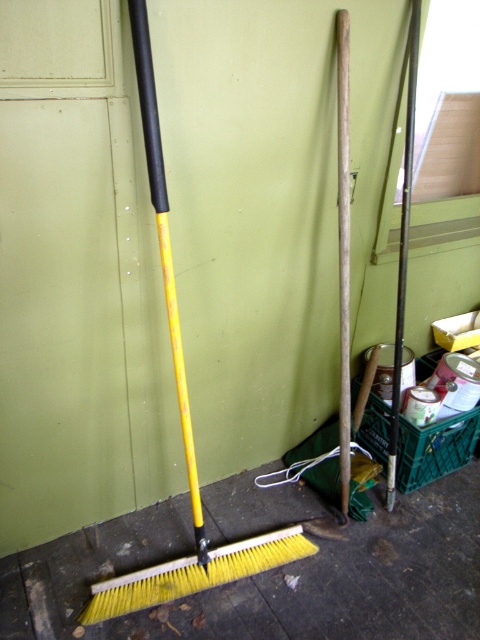
Question: Which point is farther from the camera taking this photo?

Choices:
 (A) (340, 36)
 (B) (253, 552)
 (C) (298, 529)

Answer: (C)

Question: Can you confirm if yellow plastic brush at lower left is positioned above smooth wood pole at center?

Choices:
 (A) no
 (B) yes

Answer: (A)

Question: Based on their relative distances, which object is farther from the yellow plastic brush at lower left?

Choices:
 (A) smooth wood pole at center
 (B) yellow plastic shovel at lower left

Answer: (A)

Question: Where is yellow plastic brush at lower left located in relation to smooth wood pole at center in the image?

Choices:
 (A) below
 (B) above

Answer: (A)

Question: Which object is the closest to the smooth wood pole at center?

Choices:
 (A) yellow plastic brush at lower left
 (B) yellow plastic shovel at lower left

Answer: (B)

Question: Is yellow plastic shovel at lower left in front of yellow plastic brush at lower left?

Choices:
 (A) no
 (B) yes

Answer: (B)